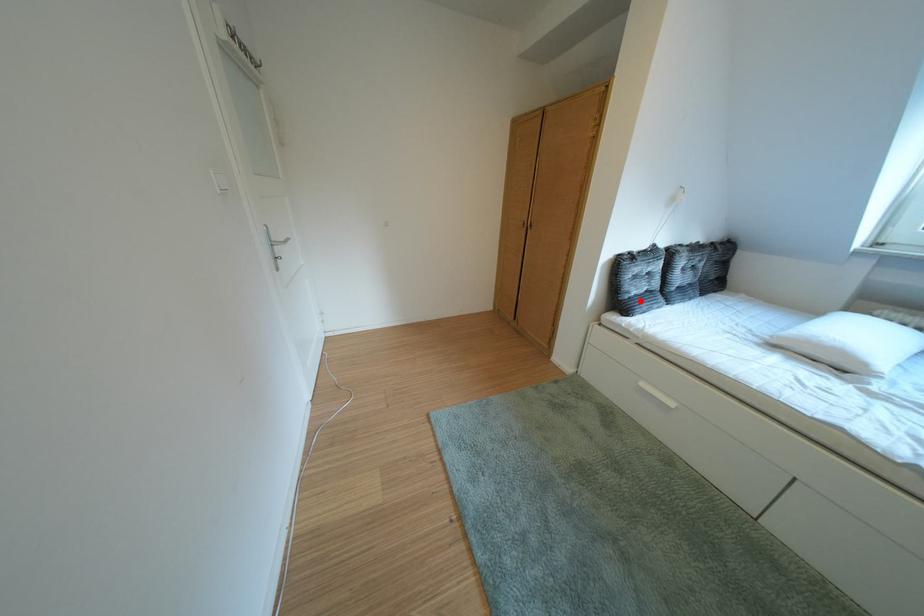
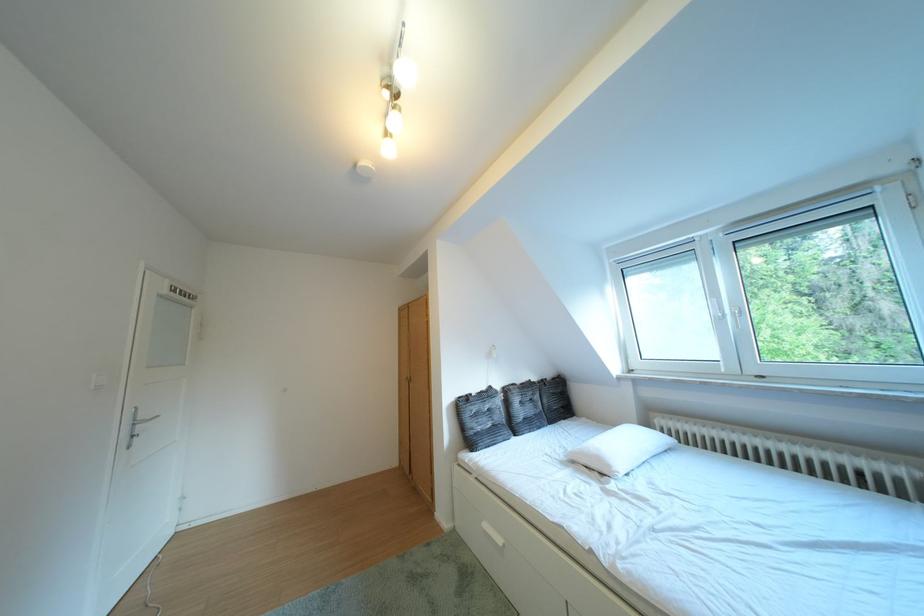
In the second image, find the point that corresponds to the highlighted location in the first image.

(484, 438)